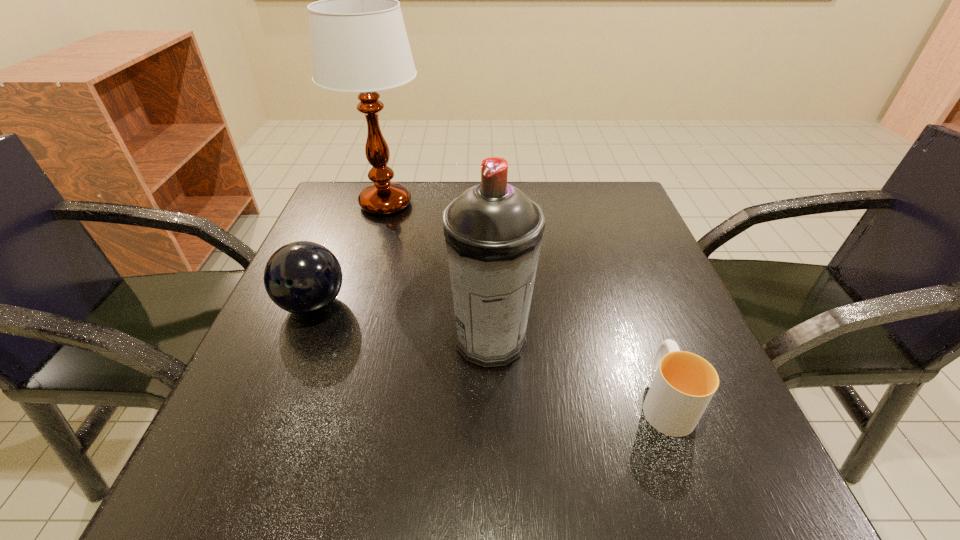
In the image, there is a desktop. Where is `vacant space at the right edge`? This screenshot has width=960, height=540. vacant space at the right edge is located at coordinates [x=660, y=282].

Identify the location of free space at the far right corner of the desktop. The height and width of the screenshot is (540, 960). (591, 222).

In order to click on vacant space at the near right corner in this screenshot , I will do `click(700, 474)`.

You are a GUI agent. You are given a task and a screenshot of the screen. Output one action in this format:
    pyautogui.click(x=<x>, y=<y>)
    Task: Click on the vacant space in between the aerosol can and the rightmost object
    This screenshot has width=960, height=540.
    Given the screenshot: What is the action you would take?
    [578, 371]

The height and width of the screenshot is (540, 960). Find the location of `free space between the third shortest object and the tallest object`. free space between the third shortest object and the tallest object is located at coordinates (438, 272).

This screenshot has height=540, width=960. What are the coordinates of `vacant point located between the third object from left to right and the third tallest object` in the screenshot? It's located at (401, 322).

Locate an element on the screen. vacant space in between the third object from left to right and the cup is located at coordinates (578, 371).

Select which object is the closest to the farthest object. Please provide its 2D coordinates. Your answer should be formatted as a tuple, i.e. [(x, y)], where the tuple contains the x and y coordinates of a point satisfying the conditions above.

[(302, 277)]

Locate an element on the screen. object that ranks as the closest to the cup is located at coordinates (493, 231).

Locate an element on the screen. Image resolution: width=960 pixels, height=540 pixels. vacant area that satisfies the following two spatial constraints: 1. on the side of the bowling ball with the finger holes; 2. on the right side of the third shortest object is located at coordinates pyautogui.click(x=299, y=340).